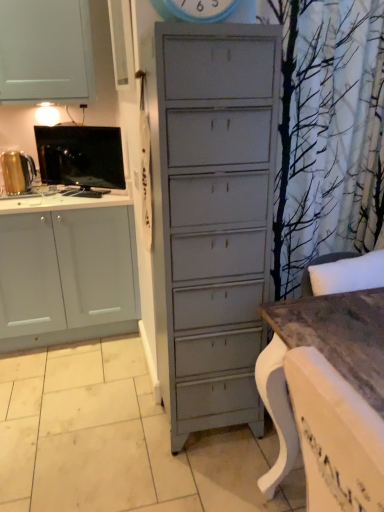
The image size is (384, 512). What do you see at coordinates (17, 170) in the screenshot?
I see `gold metallic kettle at left, which ranks as the first appliance in left-to-right order` at bounding box center [17, 170].

What do you see at coordinates (81, 156) in the screenshot? The image size is (384, 512). I see `black glossy tv at left, arranged as the first appliance when viewed from the right` at bounding box center [81, 156].

Locate an element on the screen. The height and width of the screenshot is (512, 384). wooden table at lower right is located at coordinates (338, 334).

Does wooden table at lower right have a lesser height compared to black glossy tv at left, the 2th appliance from the left?

In fact, wooden table at lower right may be taller than black glossy tv at left, the 2th appliance from the left.

Is wooden table at lower right facing away from black glossy tv at left, arranged as the first appliance when viewed from the right?

No, wooden table at lower right is not facing away from black glossy tv at left, arranged as the first appliance when viewed from the right.

Looking at this image, is wooden table at lower right not inside black glossy tv at left, arranged as the first appliance when viewed from the right?

wooden table at lower right lies outside black glossy tv at left, arranged as the first appliance when viewed from the right,'s area.

Find the location of a particular element. Image resolution: width=384 pixels, height=512 pixels. table that appears below the black glossy tv at left, the 2th appliance from the left (from the image's perspective) is located at coordinates (338, 334).

From a real-world perspective, which is physically below, gold metallic kettle at left, the 2th appliance positioned from the right, or black glossy tv at left, arranged as the first appliance when viewed from the right?

gold metallic kettle at left, the 2th appliance positioned from the right, is physically lower.

Can you confirm if gold metallic kettle at left, which ranks as the first appliance in left-to-right order, is thinner than black glossy tv at left, the 2th appliance from the left?

Incorrect, the width of gold metallic kettle at left, which ranks as the first appliance in left-to-right order, is not less than that of black glossy tv at left, the 2th appliance from the left.

Is gold metallic kettle at left, the 2th appliance positioned from the right, bigger than black glossy tv at left, arranged as the first appliance when viewed from the right?

No, gold metallic kettle at left, the 2th appliance positioned from the right, is not bigger than black glossy tv at left, arranged as the first appliance when viewed from the right.

Is wooden table at lower right wider or thinner than gold metallic kettle at left, the 2th appliance positioned from the right?

Clearly, wooden table at lower right has more width compared to gold metallic kettle at left, the 2th appliance positioned from the right.

Image resolution: width=384 pixels, height=512 pixels. I want to click on the 2nd appliance to the left of the wooden table at lower right, starting your count from the anchor, so 17,170.

From a real-world perspective, which is physically above, wooden table at lower right or gold metallic kettle at left, the 2th appliance positioned from the right?

gold metallic kettle at left, the 2th appliance positioned from the right.

Is gold metallic kettle at left, which ranks as the first appliance in left-to-right order, located within wooden table at lower right?

No, wooden table at lower right does not contain gold metallic kettle at left, which ranks as the first appliance in left-to-right order.

Is black glossy tv at left, the 2th appliance from the left, in front of gold metallic kettle at left, which ranks as the first appliance in left-to-right order?

Yes, black glossy tv at left, the 2th appliance from the left, is closer to the camera.

Looking at their sizes, would you say black glossy tv at left, arranged as the first appliance when viewed from the right, is wider or thinner than gold metallic kettle at left, which ranks as the first appliance in left-to-right order?

In the image, black glossy tv at left, arranged as the first appliance when viewed from the right, appears to be more narrow than gold metallic kettle at left, which ranks as the first appliance in left-to-right order.

Is black glossy tv at left, arranged as the first appliance when viewed from the right, aimed at gold metallic kettle at left, the 2th appliance positioned from the right?

Yes.

Consider the image. In the image, is gold metallic kettle at left, which ranks as the first appliance in left-to-right order, on the left side or the right side of wooden table at lower right?

Clearly, gold metallic kettle at left, which ranks as the first appliance in left-to-right order, is on the left of wooden table at lower right in the image.

Considering the relative sizes of gold metallic kettle at left, the 2th appliance positioned from the right, and wooden table at lower right in the image provided, is gold metallic kettle at left, the 2th appliance positioned from the right, bigger than wooden table at lower right?

Actually, gold metallic kettle at left, the 2th appliance positioned from the right, might be smaller than wooden table at lower right.

Is there a large distance between gold metallic kettle at left, which ranks as the first appliance in left-to-right order, and wooden table at lower right?

gold metallic kettle at left, which ranks as the first appliance in left-to-right order, is far away from wooden table at lower right.

From the image's perspective, is gold metallic kettle at left, which ranks as the first appliance in left-to-right order, positioned above or below wooden table at lower right?

Based on their image positions, gold metallic kettle at left, which ranks as the first appliance in left-to-right order, is located above wooden table at lower right.

Is point (96, 172) farther from camera compared to point (360, 337)?

Yes, point (96, 172) is behind point (360, 337).

Is black glossy tv at left, the 2th appliance from the left, bigger or smaller than wooden table at lower right?

In the image, black glossy tv at left, the 2th appliance from the left, appears to be smaller than wooden table at lower right.

Is wooden table at lower right completely or partially inside black glossy tv at left, the 2th appliance from the left?

Definitely not — wooden table at lower right is not inside black glossy tv at left, the 2th appliance from the left.

Where is `appliance that is the 1st object located behind the wooden table at lower right`? appliance that is the 1st object located behind the wooden table at lower right is located at coordinates (81, 156).

Identify the location of appliance that is below the black glossy tv at left, arranged as the first appliance when viewed from the right (from the image's perspective). (17, 170).

Based on their spatial positions, is gold metallic kettle at left, which ranks as the first appliance in left-to-right order, or black glossy tv at left, arranged as the first appliance when viewed from the right, closer to wooden table at lower right?

The object closer to wooden table at lower right is black glossy tv at left, arranged as the first appliance when viewed from the right.

From the image, which object appears to be nearer to black glossy tv at left, the 2th appliance from the left, wooden table at lower right or gold metallic kettle at left, the 2th appliance positioned from the right?

Based on the image, gold metallic kettle at left, the 2th appliance positioned from the right, appears to be nearer to black glossy tv at left, the 2th appliance from the left.

When comparing their distances from gold metallic kettle at left, which ranks as the first appliance in left-to-right order, does black glossy tv at left, arranged as the first appliance when viewed from the right, or wooden table at lower right seem closer?

black glossy tv at left, arranged as the first appliance when viewed from the right, is positioned closer to the anchor gold metallic kettle at left, which ranks as the first appliance in left-to-right order.

Estimate the real-world distances between objects in this image. Which object is further from gold metallic kettle at left, the 2th appliance positioned from the right, wooden table at lower right or black glossy tv at left, arranged as the first appliance when viewed from the right?

wooden table at lower right is further to gold metallic kettle at left, the 2th appliance positioned from the right.

From the image, which object appears to be nearer to wooden table at lower right, black glossy tv at left, the 2th appliance from the left, or gold metallic kettle at left, the 2th appliance positioned from the right?

black glossy tv at left, the 2th appliance from the left.

When comparing their distances from black glossy tv at left, arranged as the first appliance when viewed from the right, does gold metallic kettle at left, which ranks as the first appliance in left-to-right order, or wooden table at lower right seem further?

Among the two, wooden table at lower right is located further to black glossy tv at left, arranged as the first appliance when viewed from the right.

This screenshot has width=384, height=512. I want to click on appliance between wooden table at lower right and gold metallic kettle at left, which ranks as the first appliance in left-to-right order, in the front-back direction, so click(81, 156).